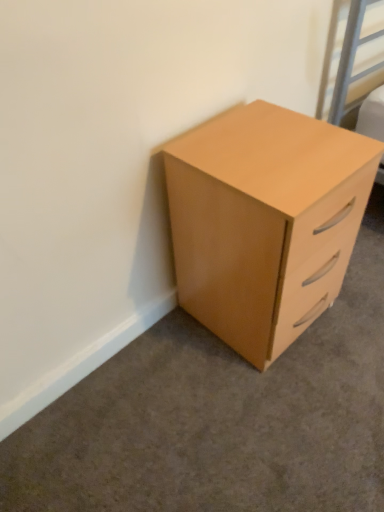
This screenshot has height=512, width=384. What are the coordinates of `free point above light brown wood chest of drawers at lower right (from a real-world perspective)` in the screenshot? It's located at (251, 133).